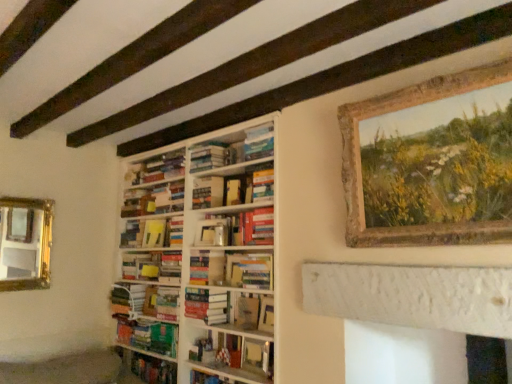
Question: Based on their sizes in the image, would you say hardcover book at center, positioned as the 2th book in bottom-to-top order, is bigger or smaller than hardcover books at center, which is counted as the 1th book, starting from the top?

Choices:
 (A) small
 (B) big

Answer: (B)

Question: From a real-world perspective, is hardcover book at center, the 8th book viewed from the top, physically located above or below hardcover books at center, marked as the 9th book in a bottom-to-top arrangement?

Choices:
 (A) above
 (B) below

Answer: (B)

Question: Which object is the closest to the hardcover book at center, the 4th paperback book when ordered from top to bottom?

Choices:
 (A) white wooden bookcase at center
 (B) hardcover book at center, positioned as the 2th book in bottom-to-top order
 (C) hardcover book at center, arranged as the fifth paperback book when ordered from the bottom
 (D) hardcover books at center, the 8th book from the bottom
 (E) hardcover book at center, positioned as the fifth book in bottom-to-top order

Answer: (C)

Question: Which of these objects is positioned closest to the hardcover book at center, which ranks as the 7th book in top-to-bottom order?

Choices:
 (A) hardcover book at center, which appears as the first paperback book when ordered from the bottom
 (B) green matte book at center, which is counted as the first book, starting from the bottom
 (C) yellow paper at center, the 2th paperback book in the bottom-to-top sequence
 (D) hardcover books at center, marked as the 9th book in a bottom-to-top arrangement
 (E) hardcover book at center, the 4th paperback book when ordered from top to bottom

Answer: (B)